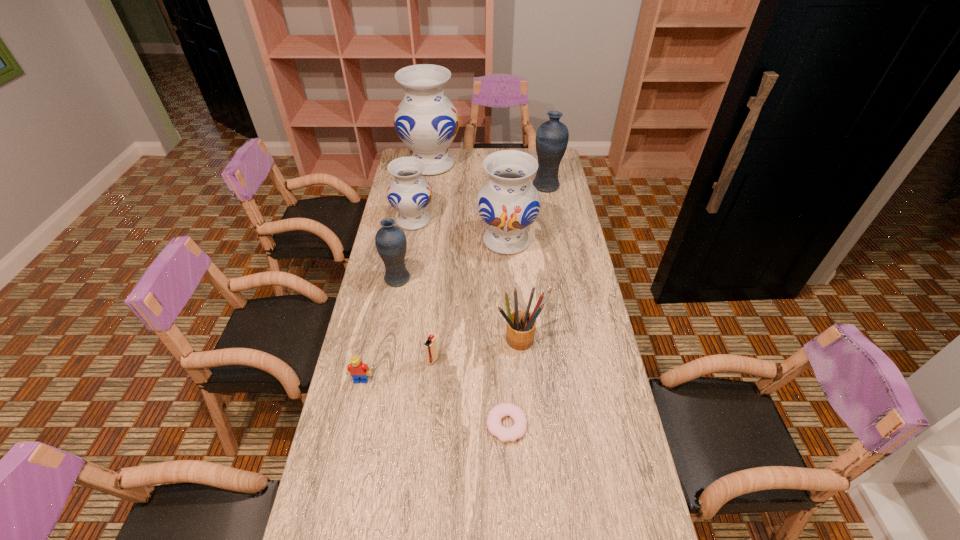
Identify the location of vacant space located on the right of the fifth farthest object. The height and width of the screenshot is (540, 960). (504, 279).

Identify the location of blank area located 0.330m on the back of the smallest red vase. Image resolution: width=960 pixels, height=540 pixels. (422, 169).

In order to click on vacant space positioned on the left of the brown pencil box in this screenshot , I will do `click(466, 339)`.

Find the location of a particular element. The height and width of the screenshot is (540, 960). free space located on the back of the seventh farthest object is located at coordinates (437, 315).

Where is `vacant space located on the face of the eighth farthest object`? The height and width of the screenshot is (540, 960). vacant space located on the face of the eighth farthest object is located at coordinates (341, 474).

Locate an element on the screen. The image size is (960, 540). free space located on the back of the nearest object is located at coordinates (502, 333).

In order to click on object that is positioned at the far edge in this screenshot , I will do `click(427, 122)`.

Identify the location of Lego that is at the left edge. (358, 370).

This screenshot has height=540, width=960. What are the coordinates of `object that is positioned at the right edge` in the screenshot? It's located at (552, 136).

Identify the location of object that is at the far left corner. Image resolution: width=960 pixels, height=540 pixels. (427, 122).